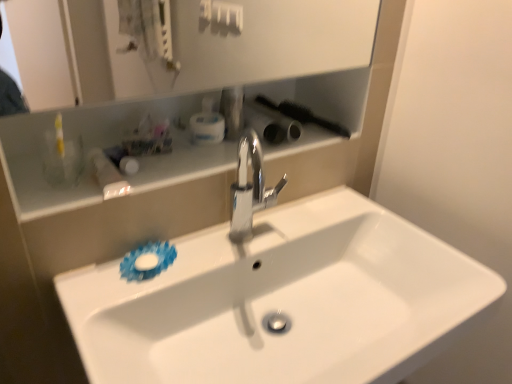
Identify the location of blank space situated above white glossy shelf at upper center (from a real-world perspective). (195, 151).